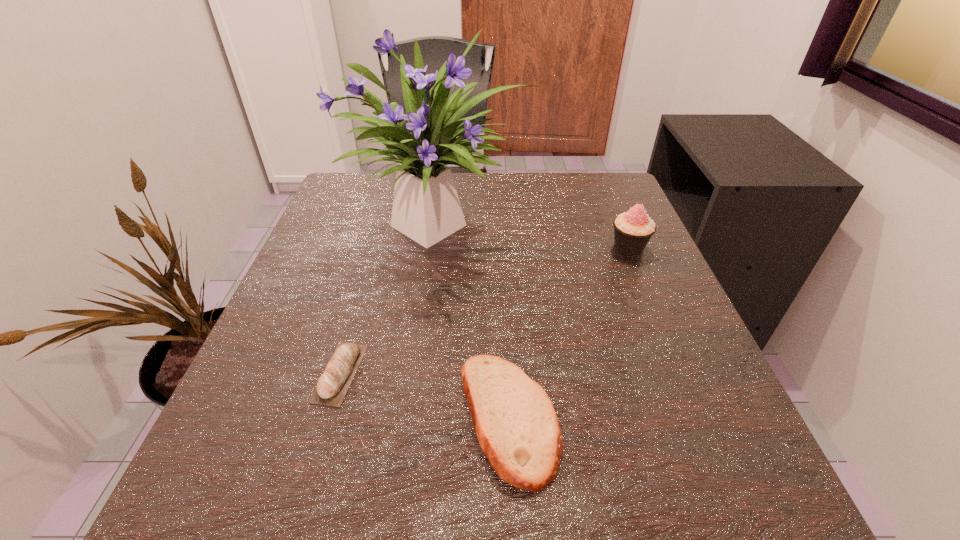
Image resolution: width=960 pixels, height=540 pixels. What are the coordinates of `vacant space at the far left corner of the desktop` in the screenshot? It's located at (372, 219).

The image size is (960, 540). I want to click on vacant space at the near left corner of the desktop, so click(x=233, y=478).

In the image, there is a desktop. Where is `vacant space at the far right corner`? This screenshot has width=960, height=540. vacant space at the far right corner is located at coordinates (568, 226).

At what (x,y) coordinates should I click in order to perform the action: click on free spot between the left pita bread and the rightmost object. Please return your answer as a coordinate pair (x, y). The width and height of the screenshot is (960, 540). Looking at the image, I should click on tap(485, 310).

Identify the location of empty location between the shortest object and the flower arrangement. This screenshot has height=540, width=960. (390, 298).

What are the coordinates of `free point between the shorter pita bread and the taller pita bread` in the screenshot? It's located at (424, 396).

At what (x,y) coordinates should I click in order to perform the action: click on vacant space that is in between the flower arrangement and the shorter pita bread. Please return your answer as a coordinate pair (x, y). The height and width of the screenshot is (540, 960). Looking at the image, I should click on (390, 298).

This screenshot has width=960, height=540. I want to click on vacant area between the rightmost object and the flower arrangement, so click(534, 235).

Where is `free spot between the taller pita bread and the shorter pita bread`? This screenshot has width=960, height=540. free spot between the taller pita bread and the shorter pita bread is located at coordinates (424, 396).

Identify the location of unoccupied area between the tallest object and the taller pita bread. [x=474, y=320].